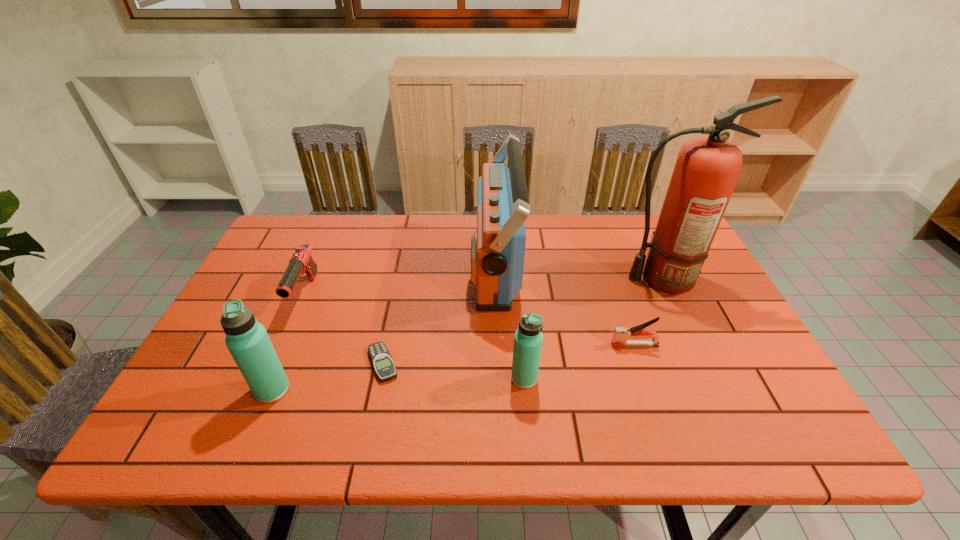
Locate an element on the screen. The image size is (960, 540). the fifth shortest object is located at coordinates (247, 340).

Identify the location of the left thermos bottle. (247, 340).

Image resolution: width=960 pixels, height=540 pixels. What are the coordinates of `the shorter thermos bottle` in the screenshot? It's located at (528, 338).

You are a GUI agent. You are given a task and a screenshot of the screen. Output one action in this format:
    pyautogui.click(x=<x>, y=<y>)
    Task: Click on the right thermos bottle
    The width and height of the screenshot is (960, 540).
    Given the screenshot: What is the action you would take?
    pyautogui.click(x=528, y=338)

Find the location of a particular element. stapler is located at coordinates (621, 334).

This screenshot has height=540, width=960. I want to click on the second tallest object, so click(498, 246).

You are a GUI agent. You are given a task and a screenshot of the screen. Output one action in this format:
    pyautogui.click(x=<x>, y=<y>)
    Task: Click on the fire extinguisher
    The image size is (960, 540).
    Given the screenshot: What is the action you would take?
    [x=707, y=169]

Image resolution: width=960 pixels, height=540 pixels. In order to click on the fifth object from right to left in this screenshot , I will do `click(381, 359)`.

This screenshot has width=960, height=540. Identify the location of beeper. (381, 359).

Locate an element on the screen. The height and width of the screenshot is (540, 960). gun is located at coordinates (301, 261).